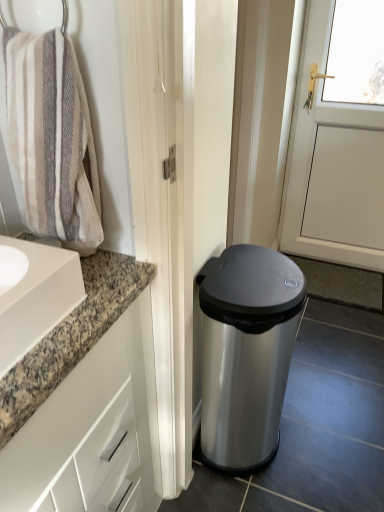
Question: From a real-world perspective, is beige textured towel at left under satin silver trash can at lower right?

Choices:
 (A) no
 (B) yes

Answer: (A)

Question: From the image's perspective, would you say beige textured towel at left is shown under satin silver trash can at lower right?

Choices:
 (A) no
 (B) yes

Answer: (A)

Question: Is beige textured towel at left far away from satin silver trash can at lower right?

Choices:
 (A) no
 (B) yes

Answer: (A)

Question: Considering the relative sizes of beige textured towel at left and satin silver trash can at lower right in the image provided, is beige textured towel at left thinner than satin silver trash can at lower right?

Choices:
 (A) yes
 (B) no

Answer: (A)

Question: Could you tell me if beige textured towel at left is facing satin silver trash can at lower right?

Choices:
 (A) yes
 (B) no

Answer: (B)

Question: Is satin silver trash can at lower right inside or outside of white glossy cabinet at left?

Choices:
 (A) outside
 (B) inside

Answer: (A)

Question: Is satin silver trash can at lower right in front of or behind white glossy cabinet at left in the image?

Choices:
 (A) behind
 (B) front

Answer: (A)

Question: Is satin silver trash can at lower right taller or shorter than white glossy cabinet at left?

Choices:
 (A) short
 (B) tall

Answer: (A)

Question: In terms of size, does satin silver trash can at lower right appear bigger or smaller than white glossy cabinet at left?

Choices:
 (A) small
 (B) big

Answer: (A)

Question: Is point (61, 501) closer or farther from the camera than point (66, 216)?

Choices:
 (A) closer
 (B) farther

Answer: (A)

Question: Is white glossy cabinet at left spatially inside beige textured towel at left, or outside of it?

Choices:
 (A) outside
 (B) inside

Answer: (A)

Question: Considering the relative positions of white glossy cabinet at left and beige textured towel at left in the image provided, is white glossy cabinet at left to the left or to the right of beige textured towel at left?

Choices:
 (A) left
 (B) right

Answer: (A)

Question: Considering the positions of white glossy cabinet at left and beige textured towel at left in the image, is white glossy cabinet at left bigger or smaller than beige textured towel at left?

Choices:
 (A) big
 (B) small

Answer: (A)

Question: From the image's perspective, is beige textured towel at left above or below satin silver trash can at lower right?

Choices:
 (A) above
 (B) below

Answer: (A)

Question: In terms of size, does beige textured towel at left appear bigger or smaller than satin silver trash can at lower right?

Choices:
 (A) big
 (B) small

Answer: (B)